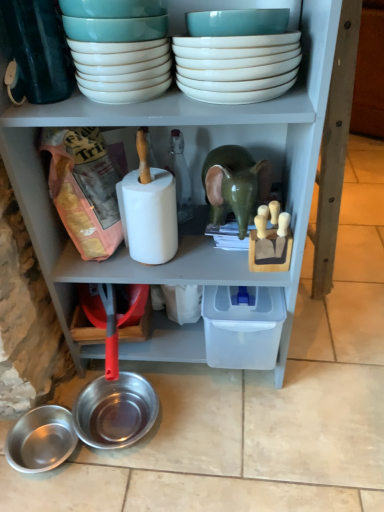
Find the location of `vacant area situated below shiny metallic bowl at lower left, which ranks as the second bowl in bottom-to-top order (from a real-world perspective)`. vacant area situated below shiny metallic bowl at lower left, which ranks as the second bowl in bottom-to-top order (from a real-world perspective) is located at coordinates (134, 432).